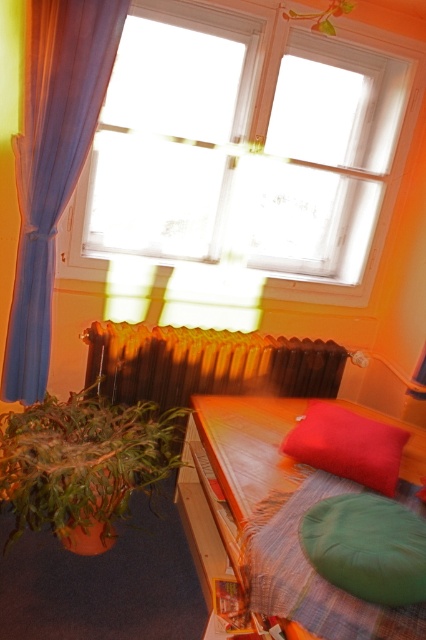
In order to click on green leafy plant at lower left in this screenshot , I will do `click(83, 465)`.

Does green leafy plant at lower left appear on the left side of wooden bed frame at lower right?

Correct, you'll find green leafy plant at lower left to the left of wooden bed frame at lower right.

Find the location of a particular element. This screenshot has height=640, width=426. green leafy plant at lower left is located at coordinates (83, 465).

At what (x,y) coordinates should I click in order to perform the action: click on green leafy plant at lower left. Please return your answer as a coordinate pair (x, y). This screenshot has width=426, height=640. Looking at the image, I should click on (83, 465).

Between point (49, 150) and point (357, 480), which one is positioned behind?

Positioned behind is point (49, 150).

Is blue sheer curtain at left shorter than matte red pillow at center?

Incorrect, blue sheer curtain at left's height does not fall short of matte red pillow at center's.

The image size is (426, 640). What do you see at coordinates (52, 163) in the screenshot?
I see `blue sheer curtain at left` at bounding box center [52, 163].

Where is `blue sheer curtain at left`? blue sheer curtain at left is located at coordinates (52, 163).

Does point (195, 390) lie behind point (386, 552)?

That is True.

Is rustic metal radiator at center to the right of green fabric pillow at lower right from the viewer's perspective?

Incorrect, rustic metal radiator at center is not on the right side of green fabric pillow at lower right.

I want to click on rustic metal radiator at center, so click(206, 364).

Where is `rustic metal radiator at center`? This screenshot has height=640, width=426. rustic metal radiator at center is located at coordinates (206, 364).